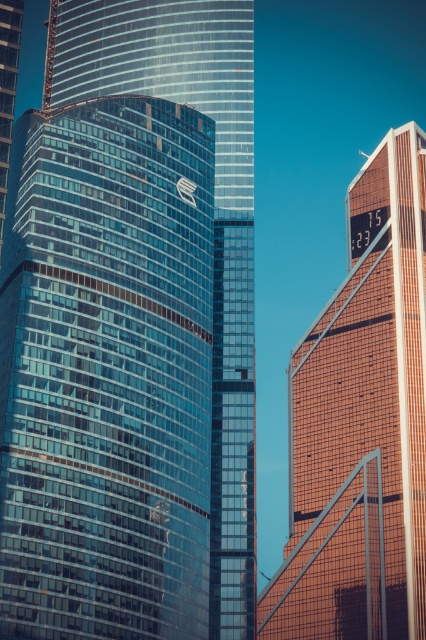
Is glassy blue skyscraper at center to the right of orange glass skyscraper at right from the viewer's perspective?

In fact, glassy blue skyscraper at center is to the left of orange glass skyscraper at right.

Does glassy blue skyscraper at center have a greater height compared to orange glass skyscraper at right?

Yes.

The height and width of the screenshot is (640, 426). What are the coordinates of `glassy blue skyscraper at center` in the screenshot? It's located at (131, 330).

The height and width of the screenshot is (640, 426). Identify the location of glassy blue skyscraper at center. (131, 330).